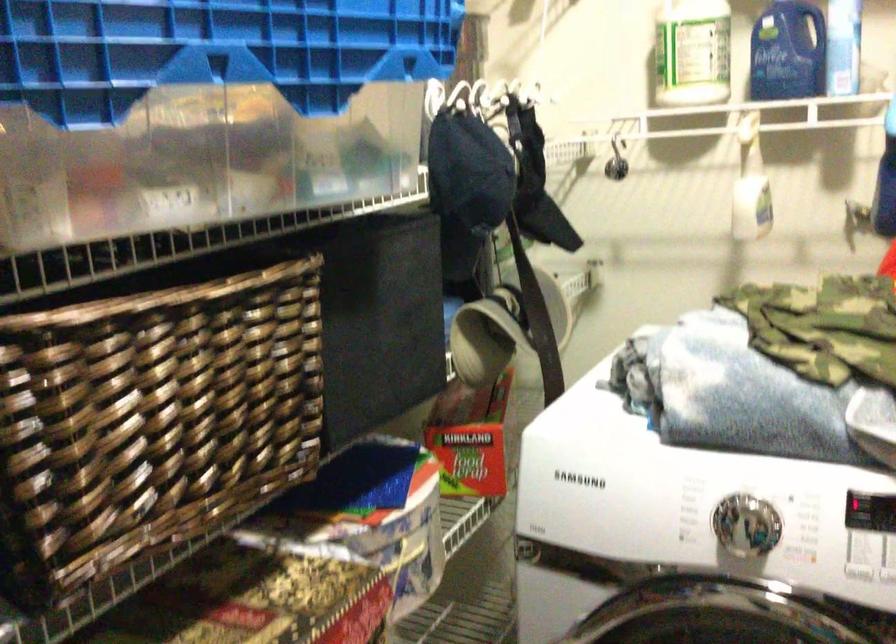
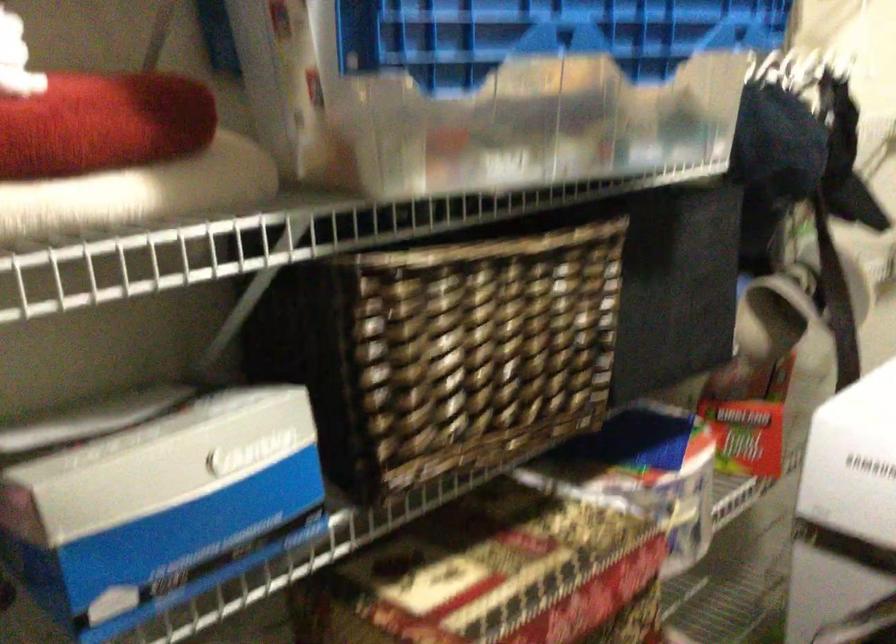
In the second image, find the point that corresponds to point (139, 412) in the first image.

(453, 344)